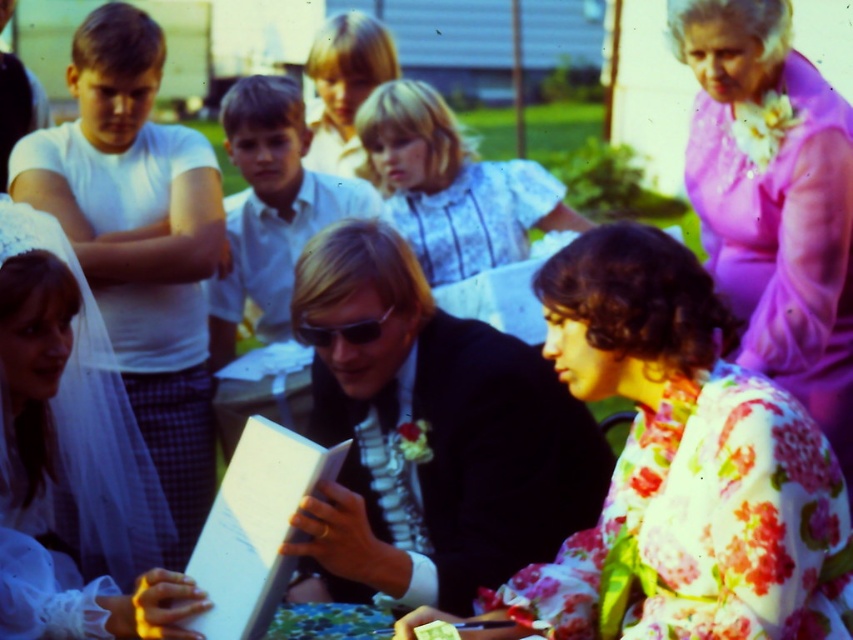
Question: Which point is farther from the camera taking this photo?

Choices:
 (A) (750, 264)
 (B) (550, 513)

Answer: (A)

Question: Can you confirm if purple satin dress at upper right is bigger than blonde hair at upper center?

Choices:
 (A) no
 (B) yes

Answer: (B)

Question: Does white satin veil at lower left have a lesser width compared to light brown hair at center?

Choices:
 (A) no
 (B) yes

Answer: (B)

Question: Is purple satin dress at upper right to the right of white lace blouse at center from the viewer's perspective?

Choices:
 (A) no
 (B) yes

Answer: (B)

Question: Estimate the real-world distances between objects in this image. Which object is farther from the light brown hair at center?

Choices:
 (A) floral silk blouse at center
 (B) white paper book at center
 (C) white lace blouse at center

Answer: (A)

Question: Which point is closer to the camera taking this photo?

Choices:
 (A) (241, 172)
 (B) (741, 36)
 (C) (235, 561)

Answer: (C)